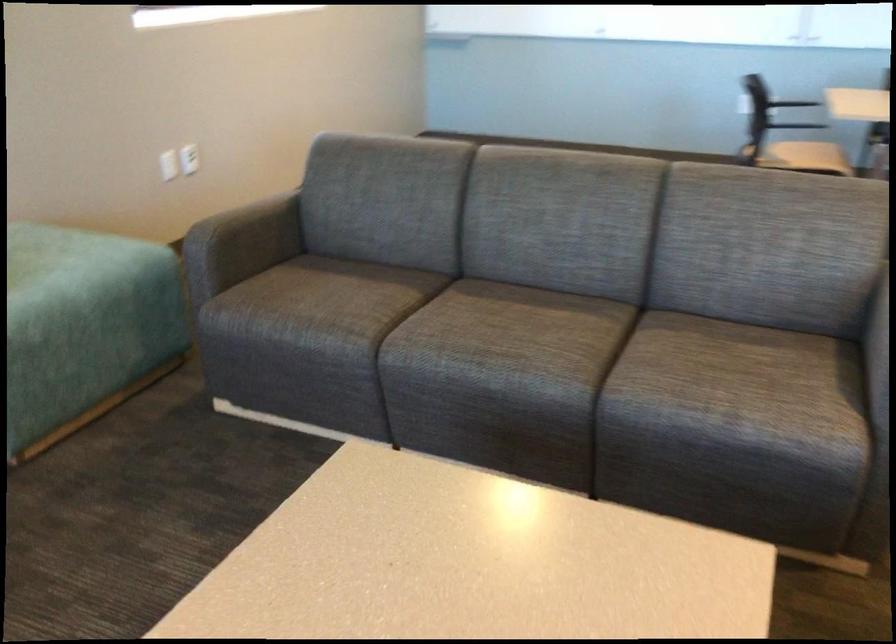
Identify the location of chair armrest. The width and height of the screenshot is (896, 644). (788, 102).